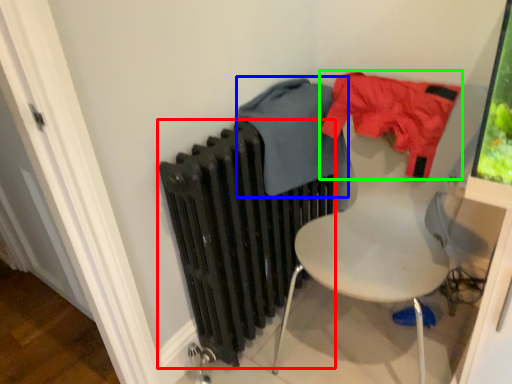
Question: Estimate the real-world distances between objects in this image. Which object is farther from radiator (highlighted by a red box), clothing (highlighted by a blue box) or clothing (highlighted by a green box)?

Choices:
 (A) clothing
 (B) clothing

Answer: (B)